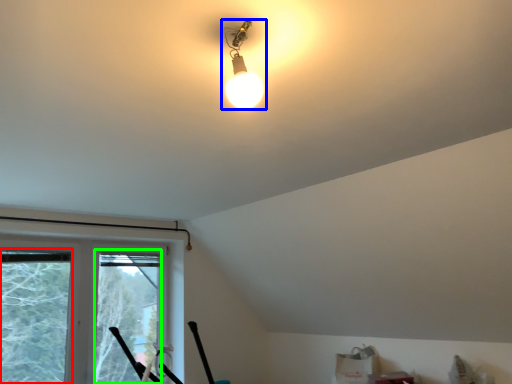
Question: Which is nearer to the window screen (highlighted by a red box)? lamp (highlighted by a blue box) or window screen (highlighted by a green box).

Choices:
 (A) lamp
 (B) window screen

Answer: (B)